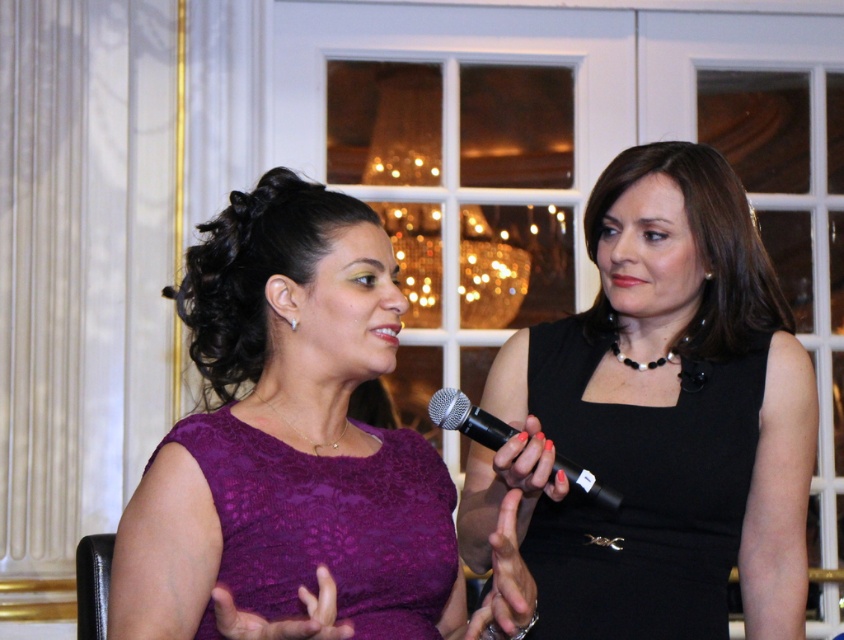
Which is behind, point (185, 477) or point (390, 632)?

Point (390, 632)

Does purple lace dress at center have a larger size compared to lace purple dress at center?

Yes.

Image resolution: width=844 pixels, height=640 pixels. Find the location of `purple lace dress at center`. purple lace dress at center is located at coordinates (298, 451).

Locate an element on the screen. Image resolution: width=844 pixels, height=640 pixels. purple lace dress at center is located at coordinates (298, 451).

Describe the element at coordinates (640, 492) in the screenshot. The height and width of the screenshot is (640, 844). I see `black satin dress at center` at that location.

Which is below, black satin dress at center or lace purple dress at center?

Positioned lower is lace purple dress at center.

Where is `black satin dress at center`? black satin dress at center is located at coordinates (640, 492).

What do you see at coordinates (329, 524) in the screenshot? I see `lace purple dress at center` at bounding box center [329, 524].

Is lace purple dress at center positioned before black matte microphone at center?

That is True.

Between point (356, 513) and point (576, 465), which one is positioned behind?

Positioned behind is point (576, 465).

Find the location of a particular element. This screenshot has width=844, height=640. lace purple dress at center is located at coordinates (329, 524).